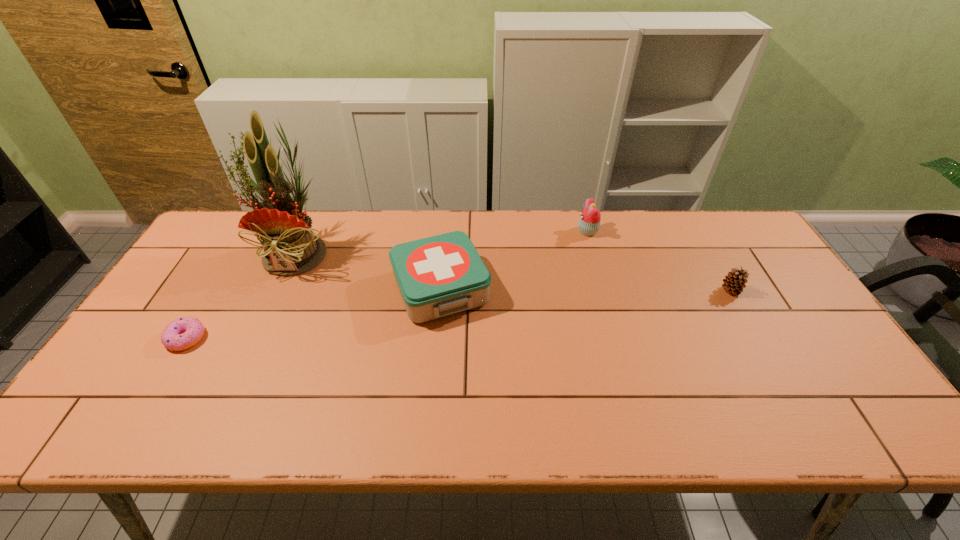
Image resolution: width=960 pixels, height=540 pixels. I want to click on vacant space located on the face of the fourth object from left to right, so click(492, 231).

Locate an element on the screen. vacant space located on the back of the third object from left to right is located at coordinates (445, 232).

Where is `vacant space positioned on the front of the pinecone`? This screenshot has width=960, height=540. vacant space positioned on the front of the pinecone is located at coordinates (780, 377).

Find the location of `vacant space positioned 0.180m on the right of the doughnut`. vacant space positioned 0.180m on the right of the doughnut is located at coordinates (275, 338).

Locate an element on the screen. The height and width of the screenshot is (540, 960). flower arrangement located at the far edge is located at coordinates (291, 248).

Locate an element on the screen. This screenshot has width=960, height=540. cupcake that is at the far edge is located at coordinates (589, 223).

The height and width of the screenshot is (540, 960). I want to click on the first-aid kit that is positioned at the far edge, so click(x=437, y=276).

This screenshot has height=540, width=960. I want to click on object that is at the left edge, so click(x=182, y=333).

What are the coordinates of `object that is at the right edge` in the screenshot? It's located at (736, 279).

Where is `vacant space at the far edge of the desktop`? This screenshot has height=540, width=960. vacant space at the far edge of the desktop is located at coordinates (667, 251).